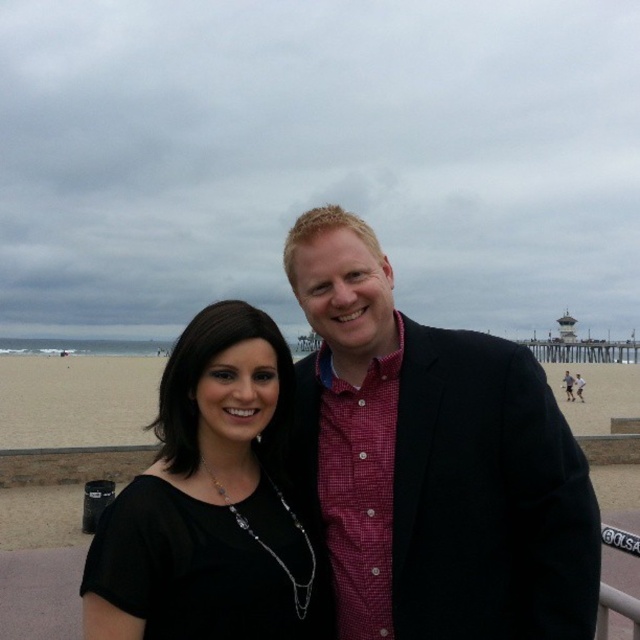
From the picture: You are a photographer trying to capture a closeup of the red checkered shirt at center. The camera you are using has a focal length of 50mm and a sensor size of 24mm x 36mm. The shirt is at coordinates point 0.722, 0.677 in the image frame. To ensure the shirt fills the frame, what adjustment should you make to your camera settings or position?

The red checkered shirt at center is positioned at point (433, 461) in the image frame. To fill the frame with the shirt, you should zoom in by increasing the focal length or move closer to the subject while maintaining focus on the shirt at point (433, 461).

You are a photographer standing at the edge of the beach. You want to take a photo of the red checkered shirt at center and the black fabric dress at center so that both are clearly visible in the frame. Given that your camera has a maximum focus range of 5 meters, will you be able to capture both subjects in focus without moving closer?

The red checkered shirt at center is 5.28 meters away from the black fabric dress at center. Since the distance between them exceeds the camera maximum focus range of 5 meters, you will not be able to capture both subjects in focus without moving closer.